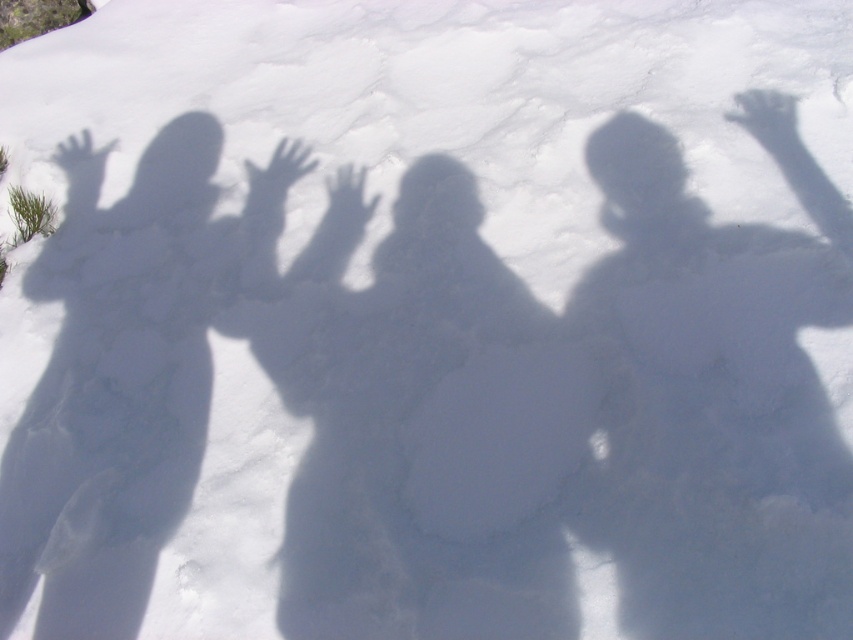
Can you confirm if dark shadow figure at center is wider than smooth shadow figure at center?

Yes, dark shadow figure at center is wider than smooth shadow figure at center.

Locate an element on the screen. The width and height of the screenshot is (853, 640). dark shadow figure at center is located at coordinates (422, 426).

At what (x,y) coordinates should I click in order to perform the action: click on dark shadow figure at center. Please return your answer as a coordinate pair (x, y). The width and height of the screenshot is (853, 640). Looking at the image, I should click on (422, 426).

Who is more forward, (549, 532) or (117, 225)?

Point (549, 532)

Is dark shadow figure at center below smooth shadow figure at left?

Indeed, dark shadow figure at center is positioned under smooth shadow figure at left.

Which is in front, point (410, 588) or point (148, 204)?

Point (410, 588)

What are the coordinates of `dark shadow figure at center` in the screenshot? It's located at (422, 426).

Who is more distant from viewer, (622, 228) or (64, 280)?

The point (64, 280) is behind.

Is smooth shadow figure at center positioned in front of smooth shadow figure at left?

Yes, it is.

The width and height of the screenshot is (853, 640). What do you see at coordinates (718, 392) in the screenshot?
I see `smooth shadow figure at center` at bounding box center [718, 392].

The height and width of the screenshot is (640, 853). Identify the location of smooth shadow figure at center. (718, 392).